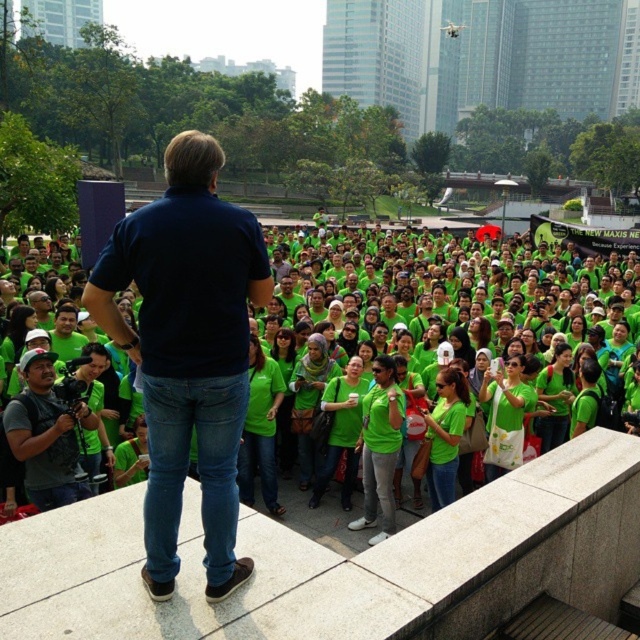
Can you confirm if green fabric shirts at center is wider than dark blue cotton shirt at center?

Indeed, green fabric shirts at center has a greater width compared to dark blue cotton shirt at center.

Who is more distant from viewer, [97,401] or [240,243]?

The point [97,401] is more distant.

You are a GUI agent. You are given a task and a screenshot of the screen. Output one action in this format:
    pyautogui.click(x=<x>, y=<y>)
    Task: Click on the green fabric shirts at center
    
    Given the screenshot: What is the action you would take?
    pyautogui.click(x=460, y=356)

In the scene shown: Which is more to the left, dark blue cotton shirt at center or matte black camera at lower left?

matte black camera at lower left is more to the left.

Who is lower down, dark blue cotton shirt at center or matte black camera at lower left?

matte black camera at lower left is lower down.

Locate an element on the screen. dark blue cotton shirt at center is located at coordinates (188, 349).

Find the location of `dark blue cotton shirt at center`. dark blue cotton shirt at center is located at coordinates (188, 349).

Between green fabric shirts at center and matte black camera at lower left, which one appears on the left side from the viewer's perspective?

Positioned to the left is matte black camera at lower left.

Is green fabric shirts at center thinner than matte black camera at lower left?

No.

This screenshot has width=640, height=640. I want to click on green fabric shirts at center, so click(460, 356).

At what (x,y) coordinates should I click in order to perform the action: click on green fabric shirts at center. Please return your answer as a coordinate pair (x, y). This screenshot has width=640, height=640. Looking at the image, I should click on (460, 356).